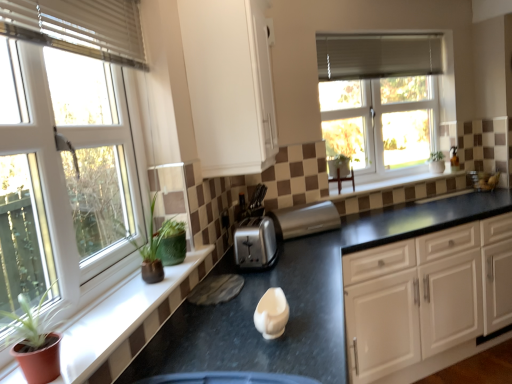
The height and width of the screenshot is (384, 512). I want to click on vacant space underneath white plastic window at left, which appears as the first window when viewed from the front (from a real-world perspective), so click(90, 306).